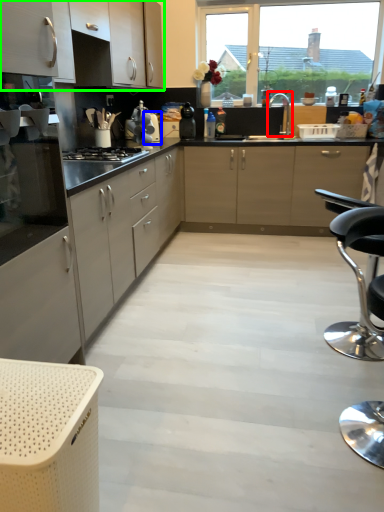
Question: Estimate the real-world distances between objects in this image. Which object is closer to tap (highlighted by a red box), appliance (highlighted by a blue box) or cabinetry (highlighted by a green box)?

Choices:
 (A) appliance
 (B) cabinetry

Answer: (A)